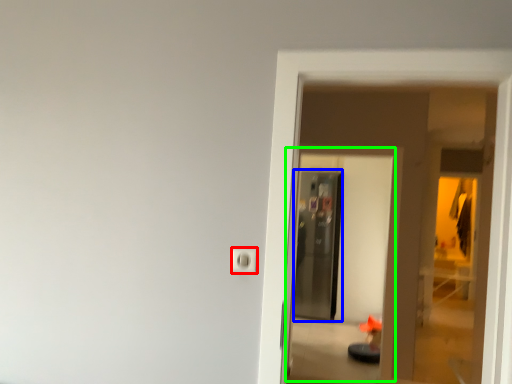
Question: Which is farther away from electric outlet (highlighted by a red box)? screen door (highlighted by a blue box) or screen door (highlighted by a green box)?

Choices:
 (A) screen door
 (B) screen door

Answer: (A)